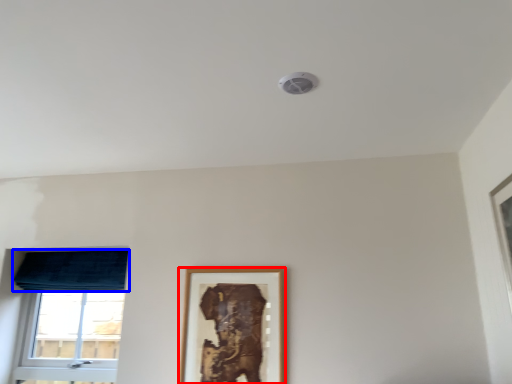
Question: Which of the following is the farthest to the observer, picture frame (highlighted by a red box) or curtain (highlighted by a blue box)?

Choices:
 (A) picture frame
 (B) curtain

Answer: (B)